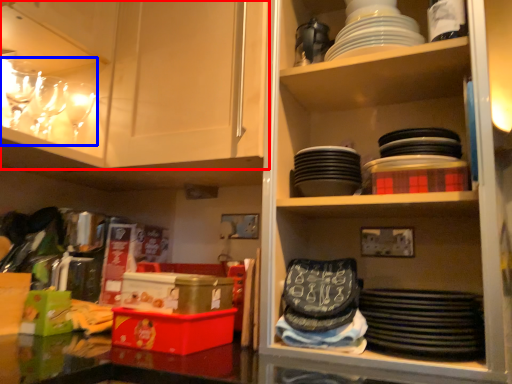
Question: Which point is further to the camera, cabinetry (highlighted by a red box) or tableware (highlighted by a blue box)?

Choices:
 (A) cabinetry
 (B) tableware

Answer: (B)